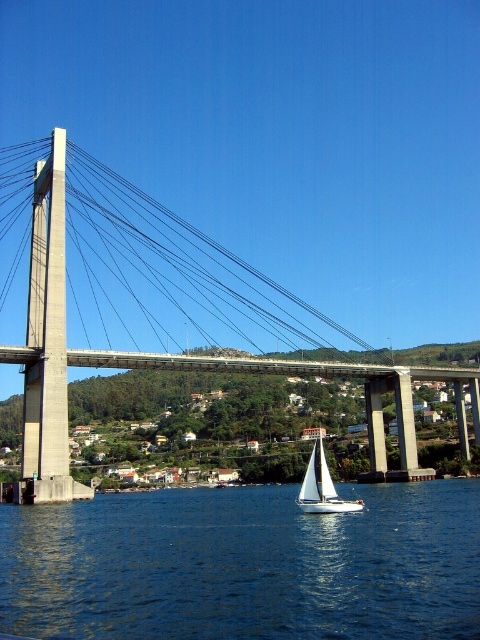
You are standing on the riverside and see two points marked in the image. The first point is at coordinates point (71, 634) and the second point is at point (421, 372). If you were to walk from the first point to the second point, would you be moving towards the bridge or away from it?

Since point (71, 634) is in front of point (421, 372), walking from the first point to the second point would mean moving away from the bridge.

You are standing on the riverside and see the point at coordinates (x=244, y=564). According to the scene, what is located at that point?

The point at coordinates (x=244, y=564) corresponds to blue liquid water at center.